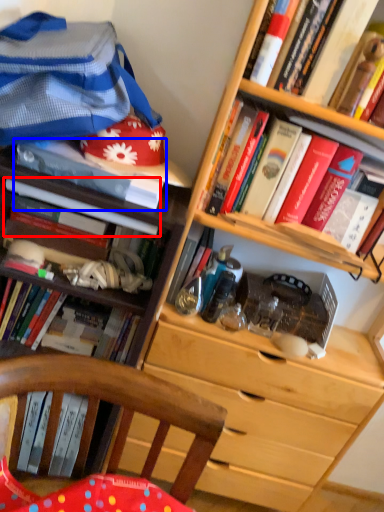
Question: Which of the following is the closest to the observer, book (highlighted by a red box) or book (highlighted by a blue box)?

Choices:
 (A) book
 (B) book

Answer: (B)